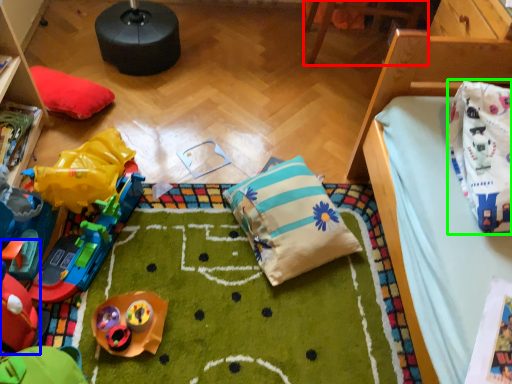
Question: Which object is positioned farthest from furniture (highlighted by a red box)? Select from toy (highlighted by a blue box) and material (highlighted by a green box).

Choices:
 (A) toy
 (B) material

Answer: (A)